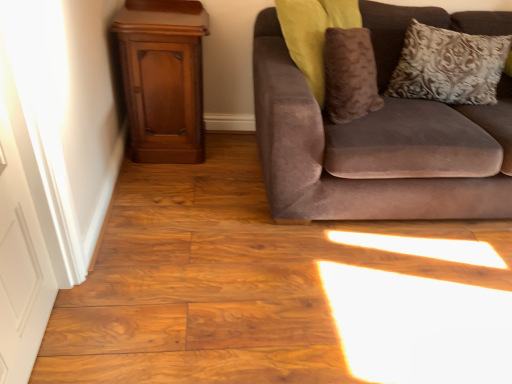
The image size is (512, 384). What are the coordinates of `vacant area located to the right-hand side of white painted wood door at left` in the screenshot? It's located at (117, 336).